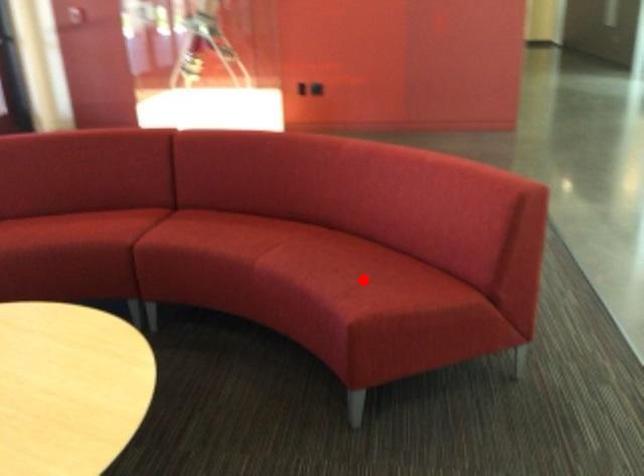
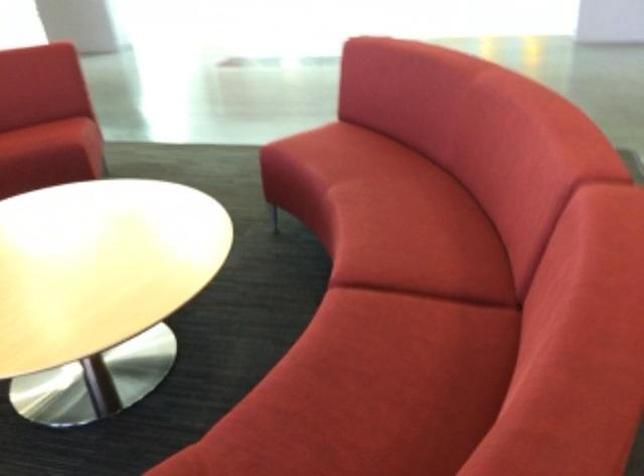
Where in the second image is the point corresponding to the highlighted location from the first image?

(46, 136)